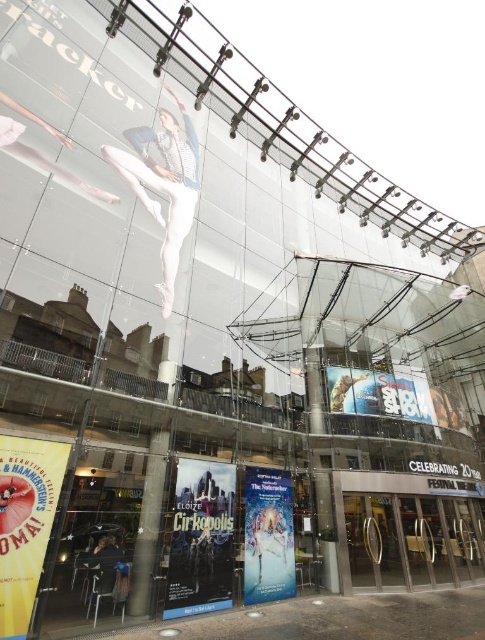
Question: From the image, what is the correct spatial relationship of yellow paper poster at lower left in relation to blue glossy poster at center?

Choices:
 (A) above
 (B) below

Answer: (A)

Question: Among these objects, which one is nearest to the camera?

Choices:
 (A) metallic silver sign at center
 (B) matte white ballet dancer at upper center

Answer: (B)

Question: Estimate the real-world distances between objects in this image. Which object is closer to the metallic silver sign at center?

Choices:
 (A) white paper poster at center
 (B) blue glossy poster at center
 (C) silver metallic doors at center

Answer: (C)

Question: Considering the real-world distances, which object is closest to the metallic silver sign at center?

Choices:
 (A) matte white ballet dancer at upper center
 (B) white paper poster at center
 (C) yellow paper poster at lower left
 (D) silver metallic doors at center

Answer: (D)

Question: Can you confirm if silver metallic doors at center is smaller than metallic silver sign at center?

Choices:
 (A) yes
 (B) no

Answer: (B)

Question: Does yellow paper poster at lower left have a smaller size compared to blue glossy poster at center?

Choices:
 (A) yes
 (B) no

Answer: (A)